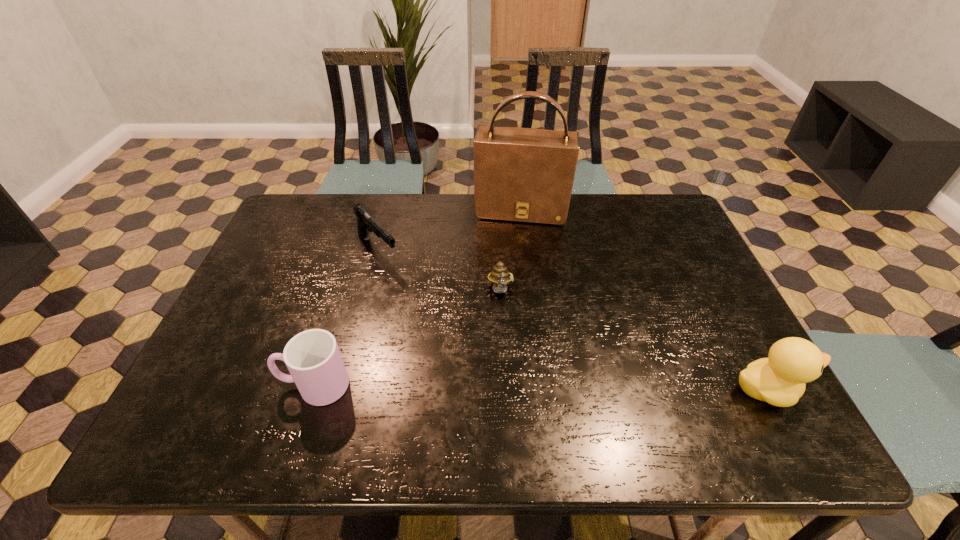
Where is `free point located at the aiming end of the fourth nearest object`? free point located at the aiming end of the fourth nearest object is located at coordinates (468, 353).

The width and height of the screenshot is (960, 540). I want to click on free space located at the aiming end of the fourth nearest object, so click(x=427, y=307).

At what (x,y) coordinates should I click in order to perform the action: click on vacant space located 0.400m on the front flap of the farthest object. Please return your answer as a coordinate pair (x, y). The width and height of the screenshot is (960, 540). Looking at the image, I should click on [x=505, y=324].

Identify the location of vacant point located on the front flap of the farthest object. This screenshot has width=960, height=540. (516, 238).

Where is `free space located on the front flap of the farthest object`? The width and height of the screenshot is (960, 540). free space located on the front flap of the farthest object is located at coordinates (508, 295).

Where is `vacant area situated 0.110m on the face of the third farthest object`? vacant area situated 0.110m on the face of the third farthest object is located at coordinates (505, 343).

Locate an element on the screen. Image resolution: width=960 pixels, height=540 pixels. vacant space located on the face of the third farthest object is located at coordinates (507, 376).

Find the location of `vacant space located on the face of the third farthest object`. vacant space located on the face of the third farthest object is located at coordinates (504, 337).

Where is `gun present at the far edge`? This screenshot has width=960, height=540. gun present at the far edge is located at coordinates (366, 223).

Identify the location of shoulder bag at the far edge. The image size is (960, 540). (526, 175).